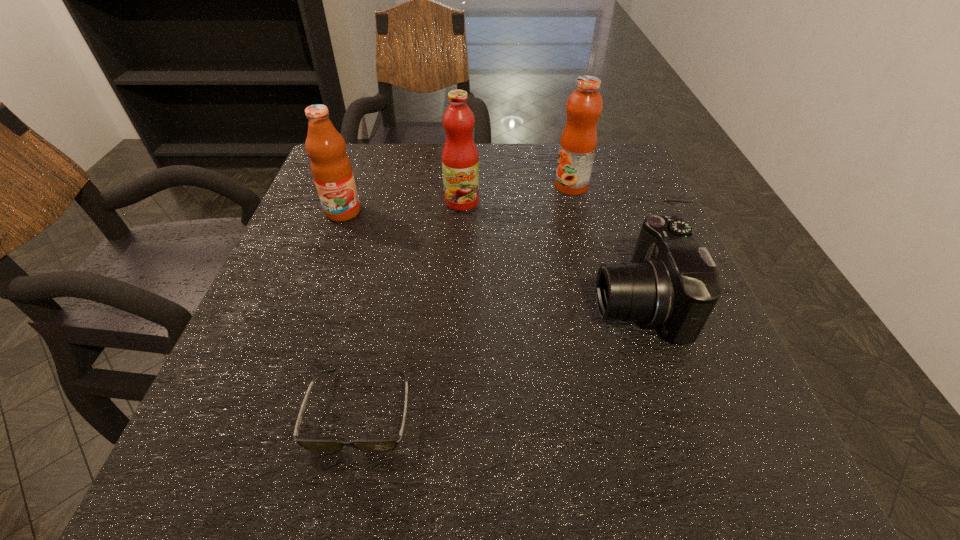
At what (x,y) coordinates should I click in order to perform the action: click on the rightmost fruit juice. Please return your answer as a coordinate pair (x, y). This screenshot has height=540, width=960. Looking at the image, I should click on (578, 142).

Locate an element on the screen. The width and height of the screenshot is (960, 540). the second fruit juice from right to left is located at coordinates (460, 160).

At what (x,y) coordinates should I click in order to perform the action: click on the leftmost object. Please return your answer as a coordinate pair (x, y). Looking at the image, I should click on (330, 166).

You are a GUI agent. You are given a task and a screenshot of the screen. Output one action in this format:
    pyautogui.click(x=<x>, y=<y>)
    Task: Click on the second nearest object
    Image resolution: width=960 pixels, height=540 pixels.
    Given the screenshot: What is the action you would take?
    pyautogui.click(x=672, y=282)

The width and height of the screenshot is (960, 540). In order to click on camera in this screenshot , I will do `click(672, 282)`.

At what (x,y) coordinates should I click in order to perform the action: click on the second object from left to right. Please return your answer as a coordinate pair (x, y). Image resolution: width=960 pixels, height=540 pixels. Looking at the image, I should click on (388, 444).

I want to click on the shortest object, so click(388, 444).

Image resolution: width=960 pixels, height=540 pixels. Identify the location of vacant area situated 0.280m on the front label of the rightmost fruit juice. (440, 187).

You are a GUI agent. You are given a task and a screenshot of the screen. Output one action in this format:
    pyautogui.click(x=<x>, y=<y>)
    Task: Click on the vacant space located 0.290m on the front label of the rightmost fruit juice
    Image resolution: width=960 pixels, height=540 pixels.
    Given the screenshot: What is the action you would take?
    pyautogui.click(x=436, y=187)

This screenshot has width=960, height=540. In order to click on free location located 0.250m on the front label of the rightmost fruit juice in this screenshot , I will do `click(452, 187)`.